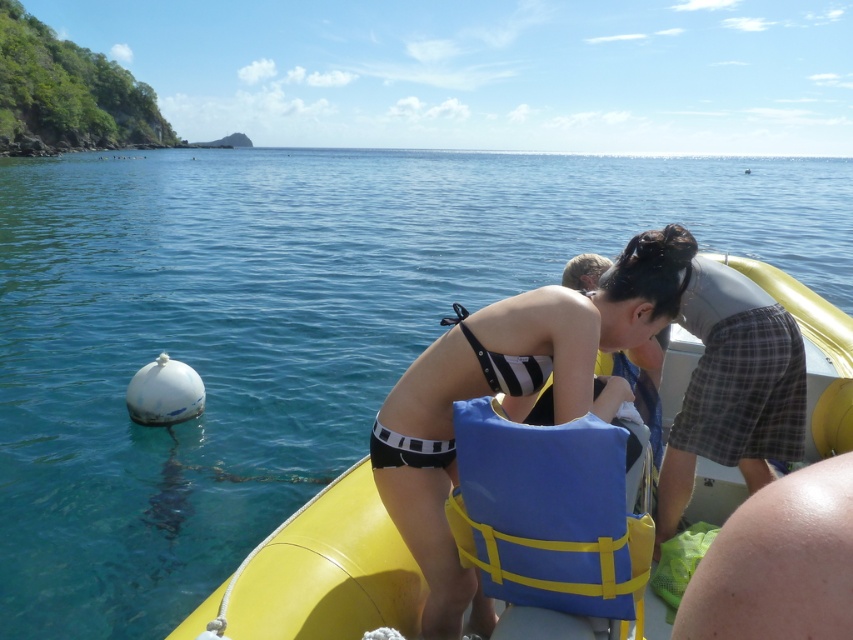
Question: Which point is farther from the camera taking this photo?

Choices:
 (A) (428, 506)
 (B) (541, 497)

Answer: (A)

Question: Can you confirm if black striped bikini at center is wider than blue fabric life jacket at center?

Choices:
 (A) yes
 (B) no

Answer: (A)

Question: Can you confirm if black striped bikini at center is positioned below blue fabric life jacket at center?

Choices:
 (A) no
 (B) yes

Answer: (A)

Question: Does black striped bikini at center have a smaller size compared to blue fabric life jacket at center?

Choices:
 (A) no
 (B) yes

Answer: (A)